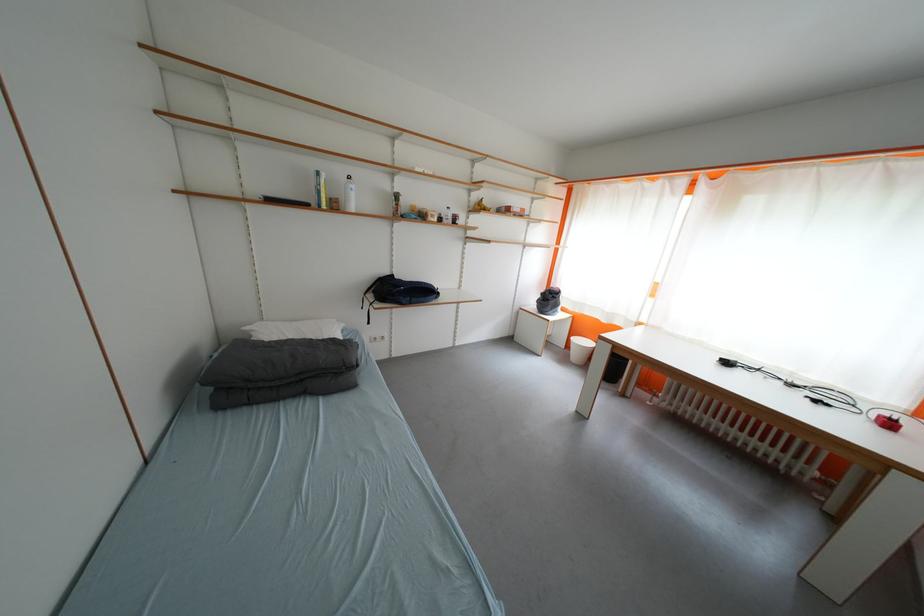
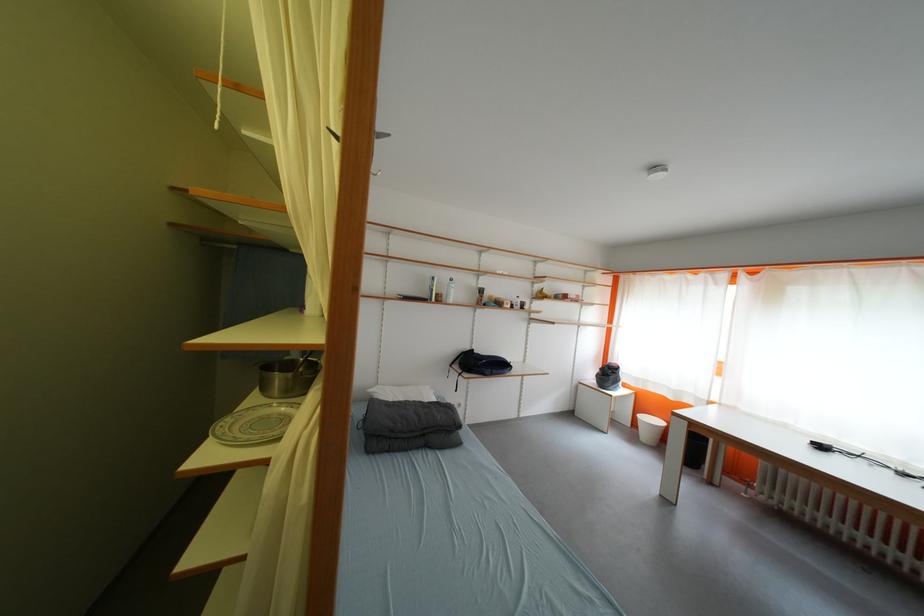
Question: I am providing you with two images of the same scene from different viewpoints. After the viewpoint changes to image2, which objects are now occluded?

Choices:
 (A) grey folded blanket
 (B) white water bottle
 (C) white trash can
 (D) none of these

Answer: (D)